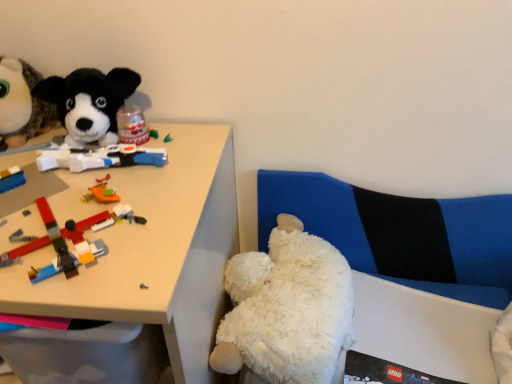
Where is `free point behind brick-like plastic toys at left, placed as the second toy when sorted from left to right`? The image size is (512, 384). free point behind brick-like plastic toys at left, placed as the second toy when sorted from left to right is located at coordinates (104, 168).